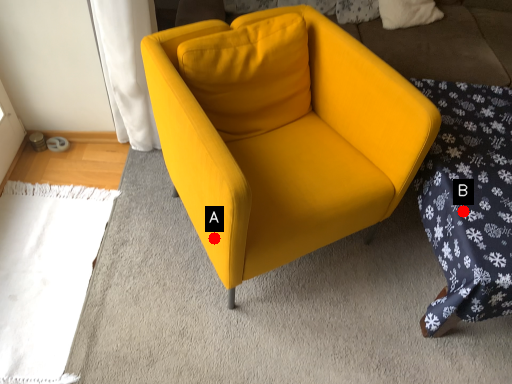
Question: Two points are circled on the image, labeled by A and B beside each circle. Which point is closer to the camera taking this photo?

Choices:
 (A) A is closer
 (B) B is closer

Answer: (A)